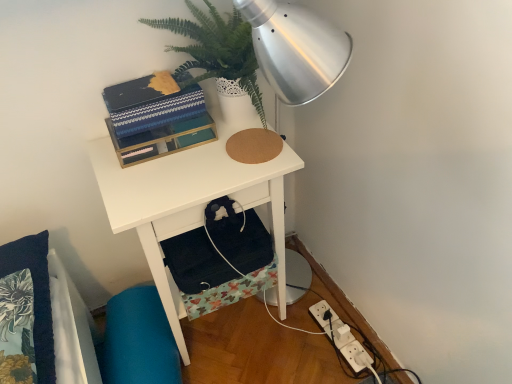
You are a GUI agent. You are given a task and a screenshot of the screen. Output one action in this format:
    pyautogui.click(x=<x>, y=<y>)
    Task: Click on the vacant area that lies in front of green leafy plant at upper center
    
    Given the screenshot: What is the action you would take?
    pyautogui.click(x=210, y=170)